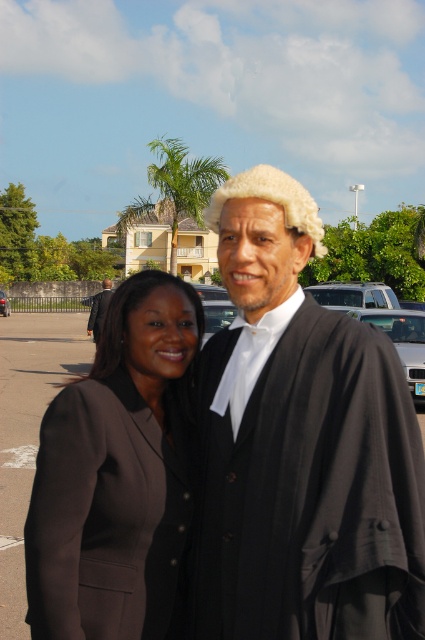
Between matte black blazer at center and silver metallic car at center-right, which one has less height?

With less height is matte black blazer at center.

Who is more forward, (178,435) or (408,365)?

Point (178,435)

Is point (99, 513) farther from camera compared to point (374, 314)?

No, it is in front of (374, 314).

At what (x,y) coordinates should I click in order to perform the action: click on matte black blazer at center. Please return your answer as a coordinate pair (x, y). The width and height of the screenshot is (425, 640). Looking at the image, I should click on (116, 474).

Looking at this image, which of these two, black woolen robe at center or black wool suit at center, stands shorter?

black woolen robe at center

From the picture: Can you confirm if black woolen robe at center is thinner than black wool suit at center?

Indeed, black woolen robe at center has a lesser width compared to black wool suit at center.

In the scene shown: Who is more distant from viewer, (408, 598) or (88, 323)?

Positioned behind is point (88, 323).

The height and width of the screenshot is (640, 425). Find the location of `black woolen robe at center`. black woolen robe at center is located at coordinates (308, 490).

Can you confirm if silver metallic car at center-right is taller than silver metallic suv at center?

No.

Who is shorter, silver metallic car at center-right or silver metallic suv at center?

With less height is silver metallic car at center-right.

Identify the location of silver metallic car at center-right. (402, 340).